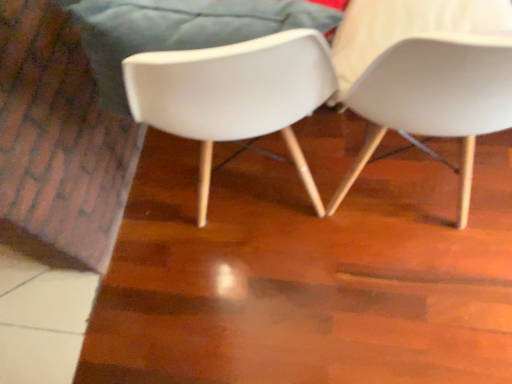
Locate an element on the screen. The image size is (512, 384). vacant space in front of white plastic chair at right, which appears as the 2th chair when viewed from the left is located at coordinates (417, 306).